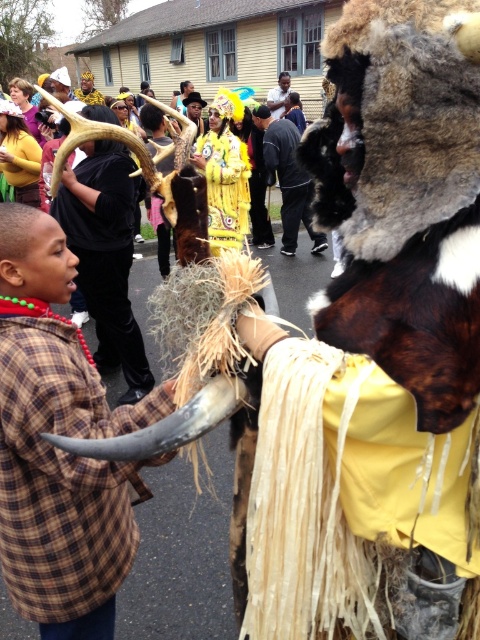
Question: Which point is farther to the camera?

Choices:
 (A) smooth skin man at center
 (B) yellow feather headdress at upper center
 (C) matte yellow fur at upper left

Answer: (B)

Question: Is brown woven grass at left positioned at the back of brown fuzzy horns at left?

Choices:
 (A) no
 (B) yes

Answer: (A)

Question: Based on their relative distances, which object is farther from the yellow feather headdress at upper center?

Choices:
 (A) brown woven grass at left
 (B) smooth skin man at center
 (C) black leather jacket at center
 (D) yellow fuzzy costume at center

Answer: (A)

Question: Can you confirm if yellow fuzzy costume at center is positioned to the left of matte yellow fur at upper left?

Choices:
 (A) no
 (B) yes

Answer: (A)

Question: Which object is positioned farthest from the brown woven grass at left?

Choices:
 (A) yellow fuzzy costume at center
 (B) smooth skin man at center
 (C) brown fuzzy horns at left
 (D) yellow feather headdress at upper center

Answer: (D)

Question: Is matte yellow fur at upper left positioned behind yellow feather headdress at upper center?

Choices:
 (A) no
 (B) yes

Answer: (A)